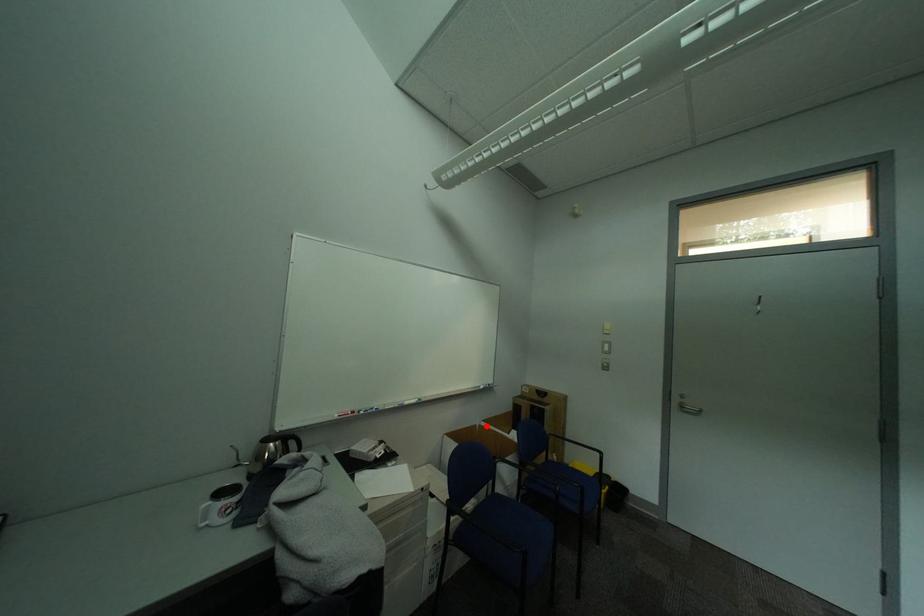
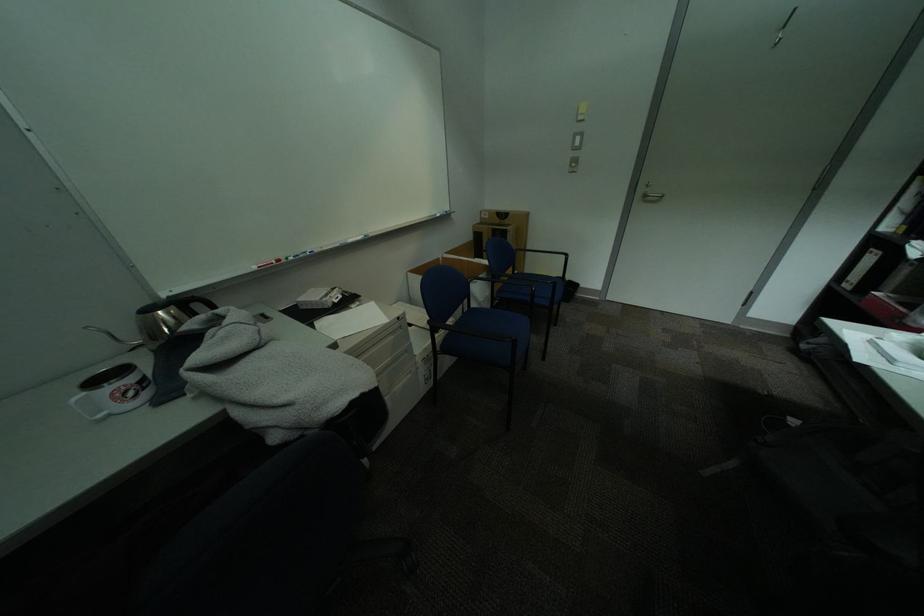
Question: I am providing you with two images of the same scene from different viewpoints. A red point is marked on the first image. Is the red point's position out of view in image 2?

Choices:
 (A) Yes
 (B) No

Answer: (B)